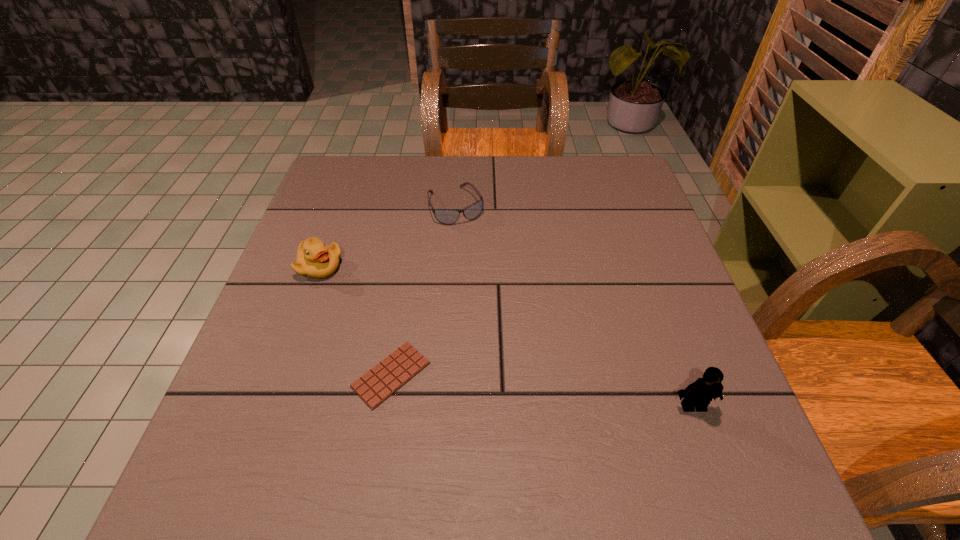
You are a GUI agent. You are given a task and a screenshot of the screen. Output one action in this format:
    pyautogui.click(x=<x>, y=<y>)
    Task: Click on the shortest object
    The image size is (960, 540).
    Given the screenshot: What is the action you would take?
    pyautogui.click(x=384, y=379)

You are a GUI agent. You are given a task and a screenshot of the screen. Output one action in this format:
    pyautogui.click(x=<x>, y=<y>)
    Task: Click on the tallest object
    
    Given the screenshot: What is the action you would take?
    point(698,394)

This screenshot has width=960, height=540. I want to click on Lego, so click(x=698, y=394).

Identify the location of duckling. (315, 259).

The height and width of the screenshot is (540, 960). Find the location of `the third nearest object`. the third nearest object is located at coordinates (315, 259).

The height and width of the screenshot is (540, 960). Find the location of `the farthest object`. the farthest object is located at coordinates (445, 216).

Image resolution: width=960 pixels, height=540 pixels. Identify the location of the second shortest object. (445, 216).

In order to click on free location located 0.300m on the right of the shortest object in this screenshot , I will do `click(590, 375)`.

What are the coordinates of `free space located 0.100m on the front-facing side of the leftmost object` in the screenshot? It's located at (366, 295).

Identify the location of free space located 0.160m on the front-facing side of the leftmost object. (385, 308).